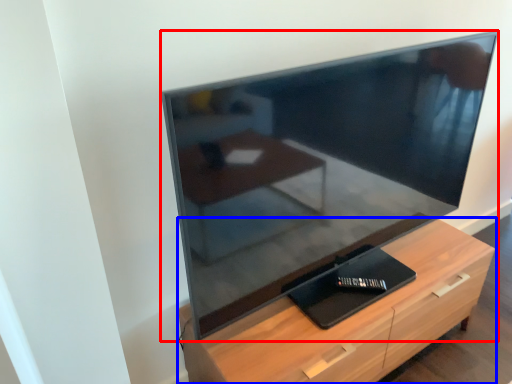
Question: Which object appears closest to the camera in this image, television (highlighted by a red box) or chest of drawers (highlighted by a blue box)?

Choices:
 (A) television
 (B) chest of drawers

Answer: (A)